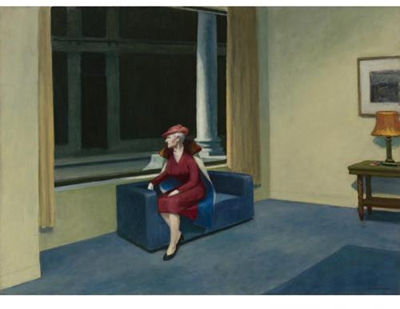
The width and height of the screenshot is (400, 309). Identify the location of painting. (287, 242).